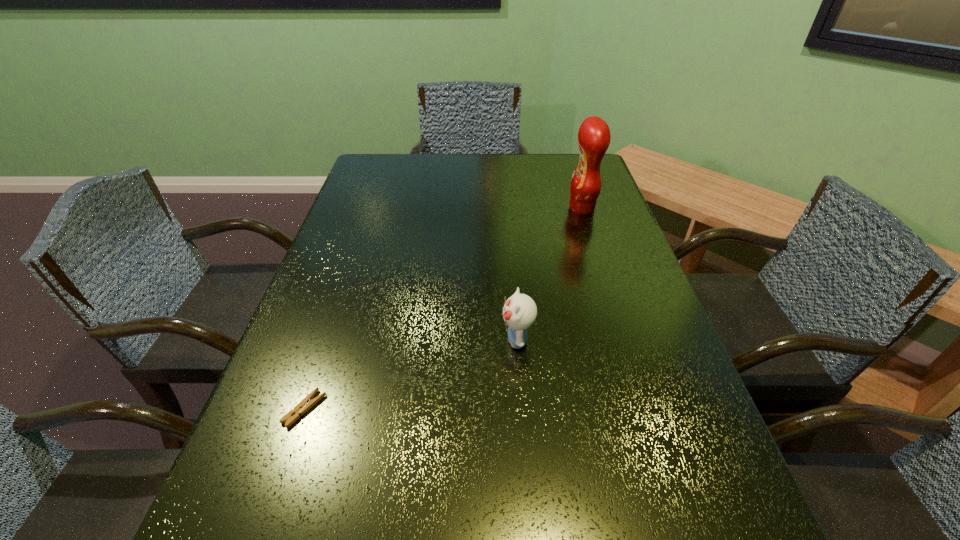
Locate an element on the screen. The width and height of the screenshot is (960, 540). free space that is in between the nearest object and the second nearest object is located at coordinates (411, 374).

I want to click on vacant space in between the clothespin and the second nearest object, so click(411, 374).

This screenshot has width=960, height=540. In order to click on empty space between the shortest object and the condiment in this screenshot , I will do `click(444, 308)`.

The width and height of the screenshot is (960, 540). In order to click on free spot between the kitten and the shortest object in this screenshot , I will do `click(411, 374)`.

Locate an element on the screen. vacant region between the second tallest object and the rightmost object is located at coordinates (549, 274).

Locate an element on the screen. The image size is (960, 540). vacant region between the second nearest object and the condiment is located at coordinates (549, 274).

Identify the location of vacant space that is in between the rightmost object and the leftmost object. The height and width of the screenshot is (540, 960). (444, 308).

Find the location of a particular element. vacant space in between the nearest object and the farthest object is located at coordinates (444, 308).

Locate an element on the screen. empty space that is in between the second object from right to left and the nearest object is located at coordinates (411, 374).

This screenshot has height=540, width=960. Find the location of `the second closest object to the second object from right to left`. the second closest object to the second object from right to left is located at coordinates (594, 137).